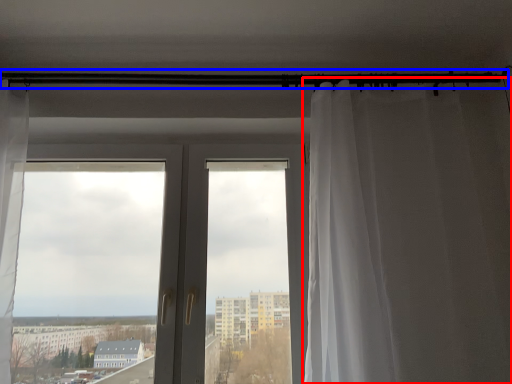
Question: Among these objects, which one is nearest to the camera, curtain (highlighted by a red box) or beam (highlighted by a blue box)?

Choices:
 (A) curtain
 (B) beam

Answer: (A)